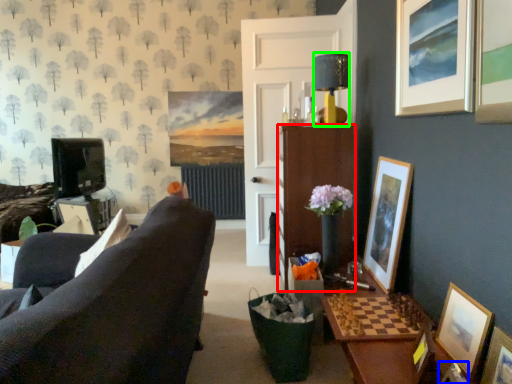
Question: Which is nearer to the cabinetry (highlighted by a red box)? picture frame (highlighted by a blue box) or lamp (highlighted by a green box).

Choices:
 (A) picture frame
 (B) lamp

Answer: (B)